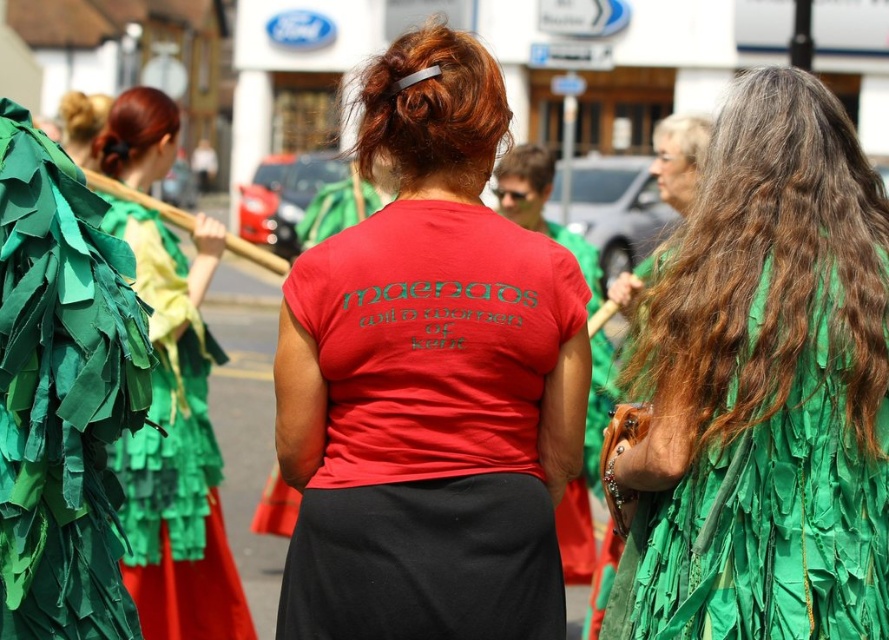
Which is in front, point (831, 550) or point (82, 138)?

Positioned in front is point (831, 550).

Who is positioned more to the left, green fringed dress at right or blondehair at upper left?

blondehair at upper left

Identify the location of green fringed dress at right. (767, 520).

In the scene shown: Measure the distance between point (538, 570) and camera.

Point (538, 570) is 27.52 meters away from camera.

Is point (455, 472) farther from viewer compared to point (73, 128)?

No, it is in front of (73, 128).

This screenshot has width=889, height=640. I want to click on matte red t-shirt at center, so click(429, 380).

Can you confirm if matte red t-shirt at center is thinner than brownhair at center?

Incorrect, matte red t-shirt at center's width is not less than brownhair at center's.

Describe the element at coordinates (429, 380) in the screenshot. I see `matte red t-shirt at center` at that location.

Locate an element on the screen. matte red t-shirt at center is located at coordinates (429, 380).